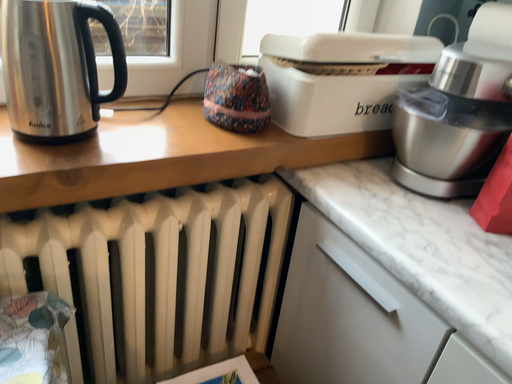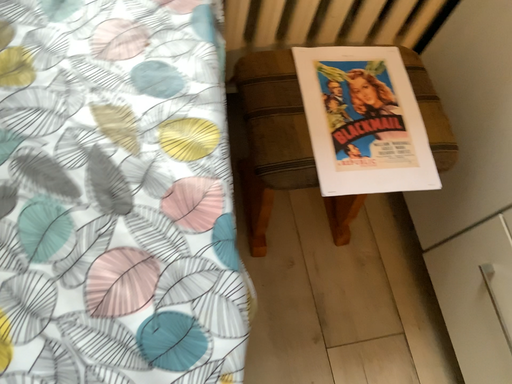
Question: Which way did the camera rotate in the video?

Choices:
 (A) rotated downward
 (B) rotated upward

Answer: (A)